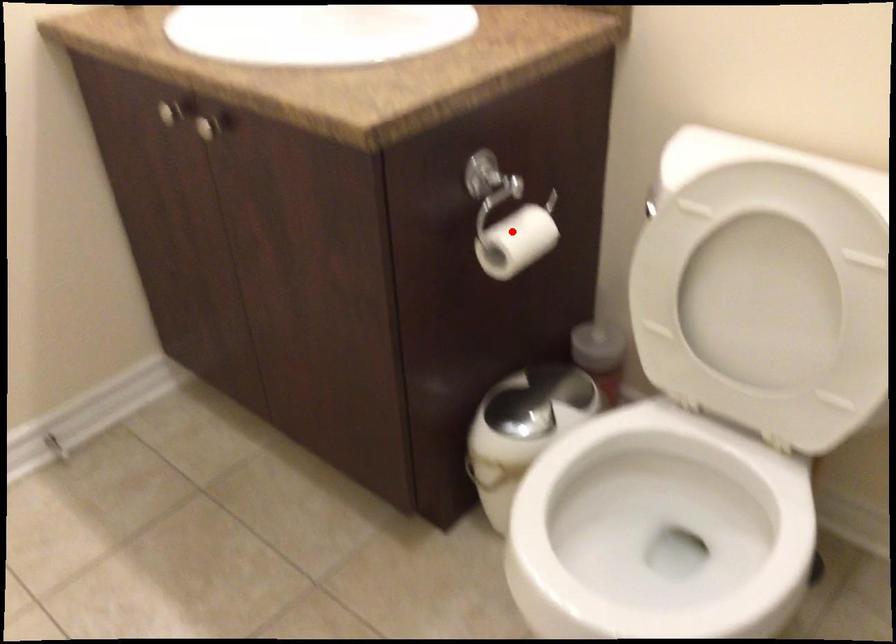
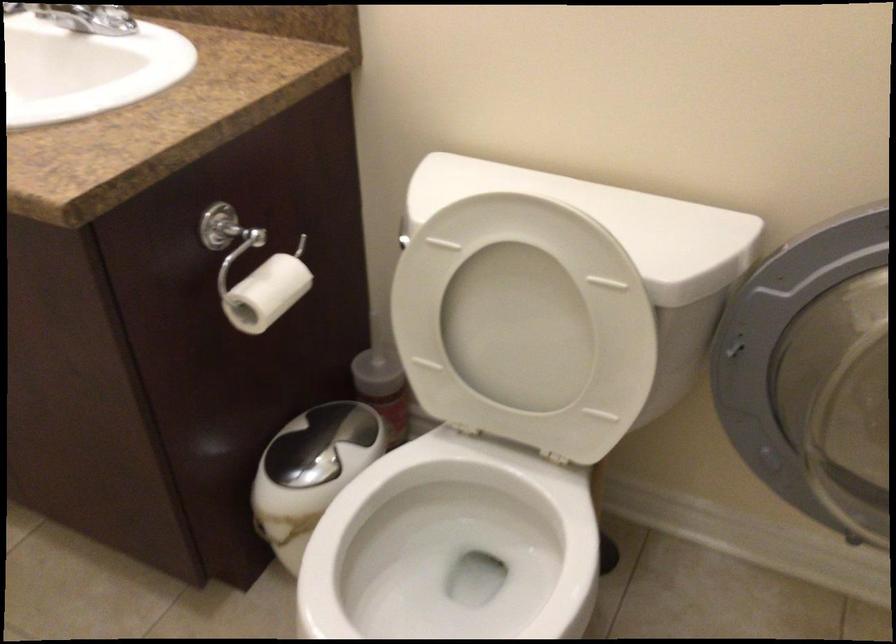
Find the pixel in the second image that matches the highlighted location in the first image.

(263, 286)